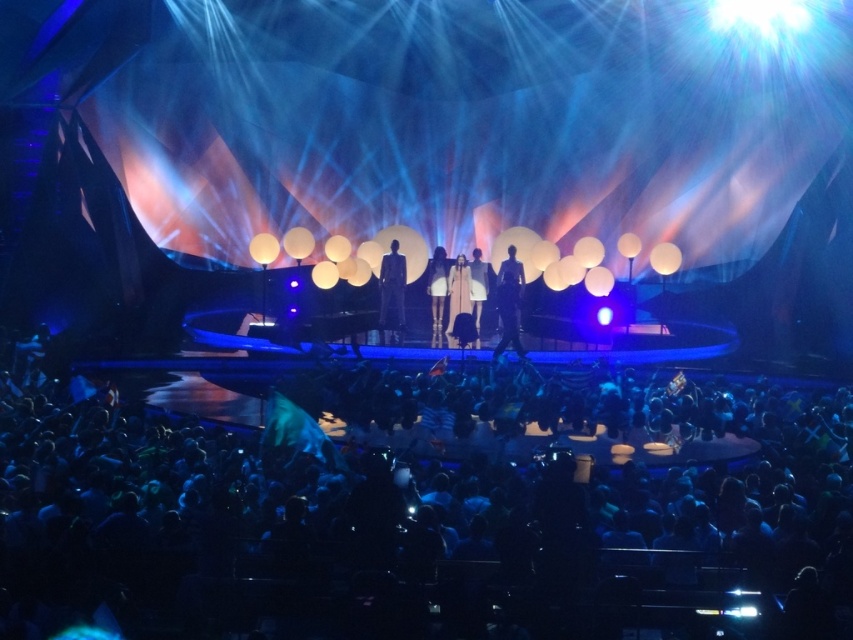
You are a stagehand adjusting the lighting for the performance. You need to place a spotlight on the stage such that it illuminates both the point at coordinates point (x=432, y=422) and point (x=402, y=291). Given that the spotlight can only focus on one point at a time, which point should you choose to ensure both points are adequately lit?

You should choose point (x=432, y=422) because it is closer to the viewer than point (x=402, y=291). By focusing the spotlight on the closer point, the light will naturally spread out and cover both points effectively.

From the picture: You are a stagehand who needs to place a 4 feet wide decorative panel between the dark gray suit at center and the silky white dress at center. Will the panel fit between them?

The distance between the dark gray suit at center and the silky white dress at center is 3.97 feet. Since the panel is 4 feet wide, it will not fit as the space is slightly narrower than the panel.

You are a photographer on the stage and want to capture both the dark gray suit at center and the silky white dress at center in a single shot. Which performer should you position closer to the camera to ensure both are fully visible?

The dark gray suit at center is to the right of the silky white dress at center. To ensure both are fully visible, position the silky white dress at center closer to the camera since it is on the left side and might be farther away if the dark gray suit is to its right.